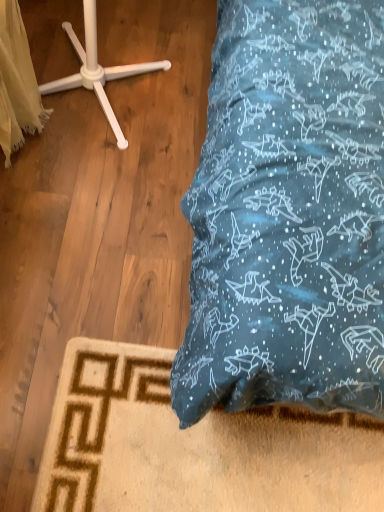
Where is `unoccupied region to the right of white plastic coat stand at upper left`? The image size is (384, 512). unoccupied region to the right of white plastic coat stand at upper left is located at coordinates (180, 121).